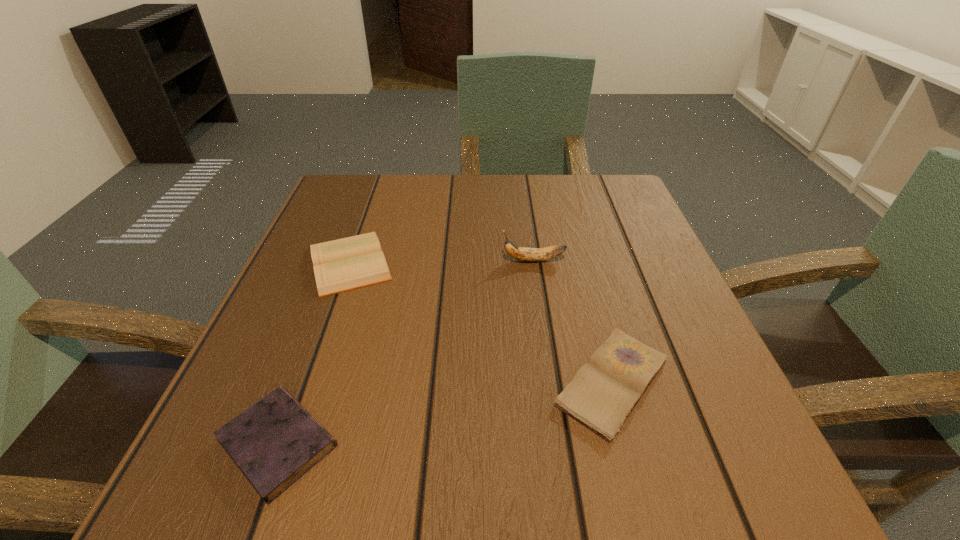
At what (x,y) coordinates should I click in order to perform the action: click on banana. Please return your answer as a coordinate pair (x, y). This screenshot has width=960, height=540. Looking at the image, I should click on (520, 253).

At what (x,y) coordinates should I click in order to perform the action: click on the farthest diary. Please return your answer as a coordinate pair (x, y). This screenshot has width=960, height=540. Looking at the image, I should click on (341, 265).

At what (x,y) coordinates should I click in order to perform the action: click on the rightmost diary. Please return your answer as a coordinate pair (x, y). The height and width of the screenshot is (540, 960). Looking at the image, I should click on (604, 391).

Find the location of a particular element. vacant space situated 0.240m on the peel of the banana is located at coordinates (380, 260).

I want to click on vacant space located on the peel of the banana, so click(324, 260).

You are a GUI agent. You are given a task and a screenshot of the screen. Output one action in this format:
    pyautogui.click(x=<x>, y=<y>)
    Task: Click on the vacant space located on the peel of the banana
    The width and height of the screenshot is (960, 540).
    Given the screenshot: What is the action you would take?
    pyautogui.click(x=324, y=260)

Image resolution: width=960 pixels, height=540 pixels. I want to click on free point located 0.170m on the front of the farthest diary, so click(x=309, y=376).

Identify the location of vacant space located 0.140m on the back of the rightmost diary. The height and width of the screenshot is (540, 960). (584, 278).

You are a GUI agent. You are given a task and a screenshot of the screen. Output one action in this format:
    pyautogui.click(x=<x>, y=<y>)
    Task: Click on the object present at the right edge
    
    Given the screenshot: What is the action you would take?
    pyautogui.click(x=604, y=391)

Image resolution: width=960 pixels, height=540 pixels. I want to click on object situated at the near left corner, so pos(274,442).